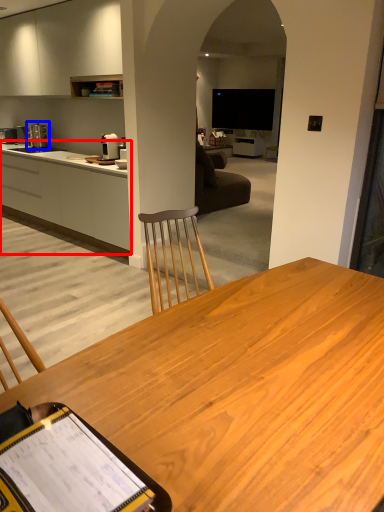
Question: Which of the following is the closest to the observer, cabinetry (highlighted by a red box) or coffee machine (highlighted by a blue box)?

Choices:
 (A) cabinetry
 (B) coffee machine

Answer: (A)